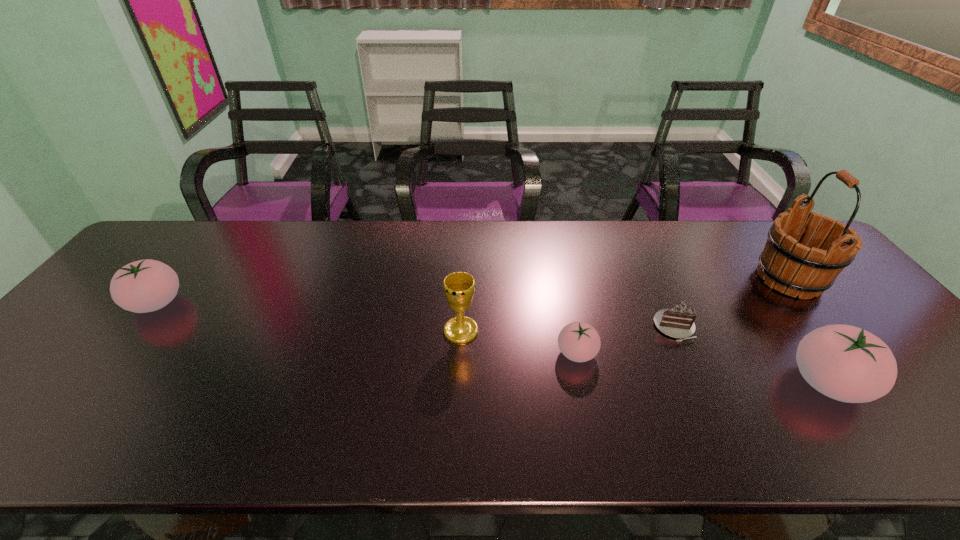
Where is `free space between the tallest object and the fifth object from right to left`? The width and height of the screenshot is (960, 540). free space between the tallest object and the fifth object from right to left is located at coordinates (625, 305).

Locate which object ranks third in proximity to the second shortest tomato. Please provide its 2D coordinates. Your answer should be formatted as a tuple, i.e. [(x, y)], where the tuple contains the x and y coordinates of a point satisfying the conditions above.

[(678, 321)]

Locate which object is the fourth closest to the fifth tallest object. Please provide its 2D coordinates. Your answer should be formatted as a tuple, i.e. [(x, y)], where the tuple contains the x and y coordinates of a point satisfying the conditions above.

[(786, 264)]

Select which tomato appears as the second closest to the second tomato from left to right. Please provide its 2D coordinates. Your answer should be formatted as a tuple, i.e. [(x, y)], where the tuple contains the x and y coordinates of a point satisfying the conditions above.

[(147, 285)]

Where is `tomato that is the third closest to the wine bucket`? The image size is (960, 540). tomato that is the third closest to the wine bucket is located at coordinates (147, 285).

Where is `free space that satisfies the following two spatial constraints: 1. on the front side of the chalice; 2. on the right side of the rightmost tomato`? The height and width of the screenshot is (540, 960). free space that satisfies the following two spatial constraints: 1. on the front side of the chalice; 2. on the right side of the rightmost tomato is located at coordinates (459, 383).

This screenshot has height=540, width=960. In order to click on free location that satisfies the following two spatial constraints: 1. on the front side of the fourth object from left to right; 2. on the right side of the rightmost tomato in this screenshot , I will do `click(700, 383)`.